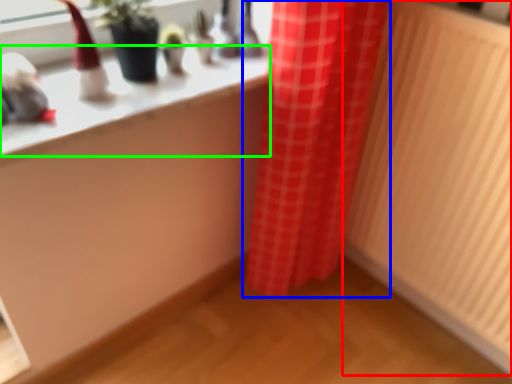
Question: Based on their relative distances, which object is farther from radiator (highlighted by a red box)? Choose from curtain (highlighted by a blue box) and counter top (highlighted by a green box).

Choices:
 (A) curtain
 (B) counter top

Answer: (B)